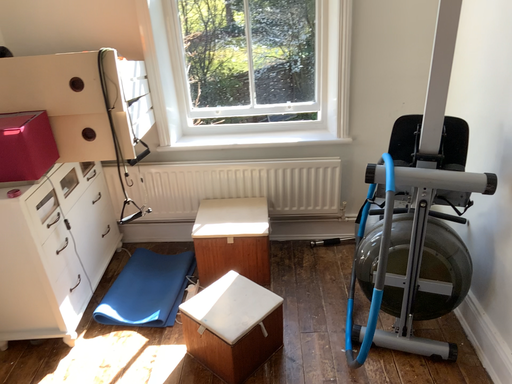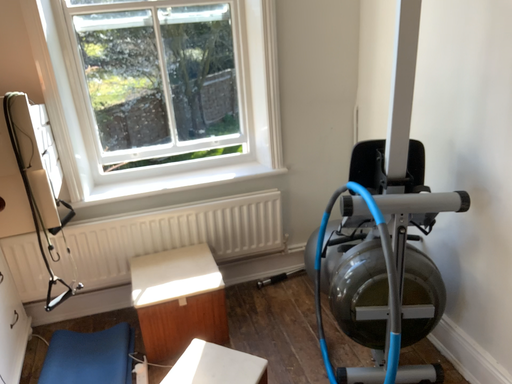
Question: How did the camera likely rotate when shooting the video?

Choices:
 (A) rotated right
 (B) rotated left

Answer: (A)